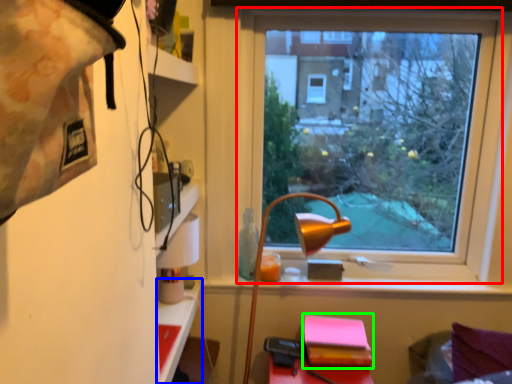
Question: Which object is the farthest from window (highlighted by a red box)? Choose among these: table (highlighted by a blue box) or notebook (highlighted by a green box).

Choices:
 (A) table
 (B) notebook

Answer: (A)